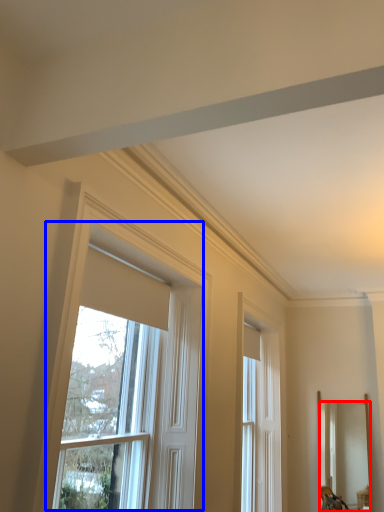
Question: Which object appears farthest to the camera in this image, mirror (highlighted by a red box) or window (highlighted by a blue box)?

Choices:
 (A) mirror
 (B) window

Answer: (A)